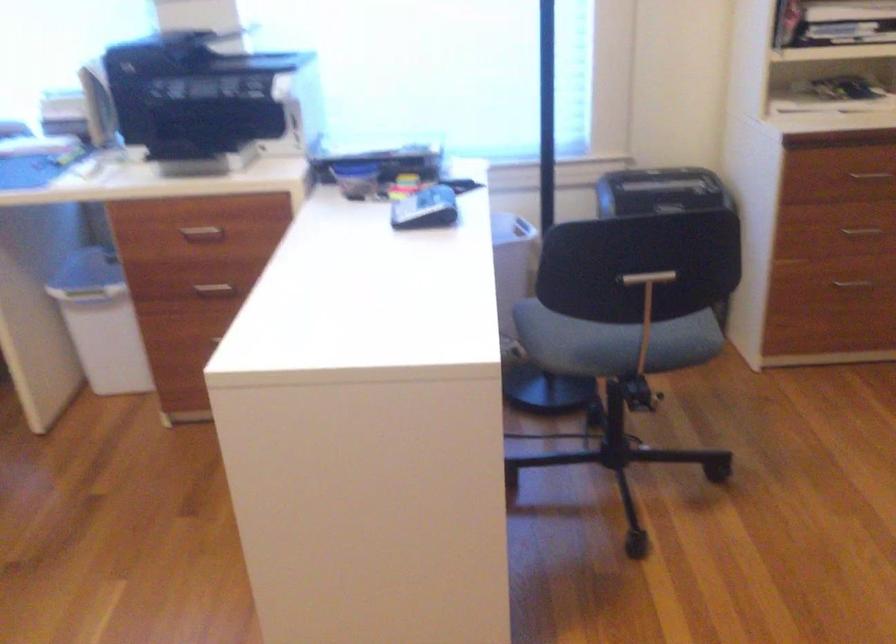
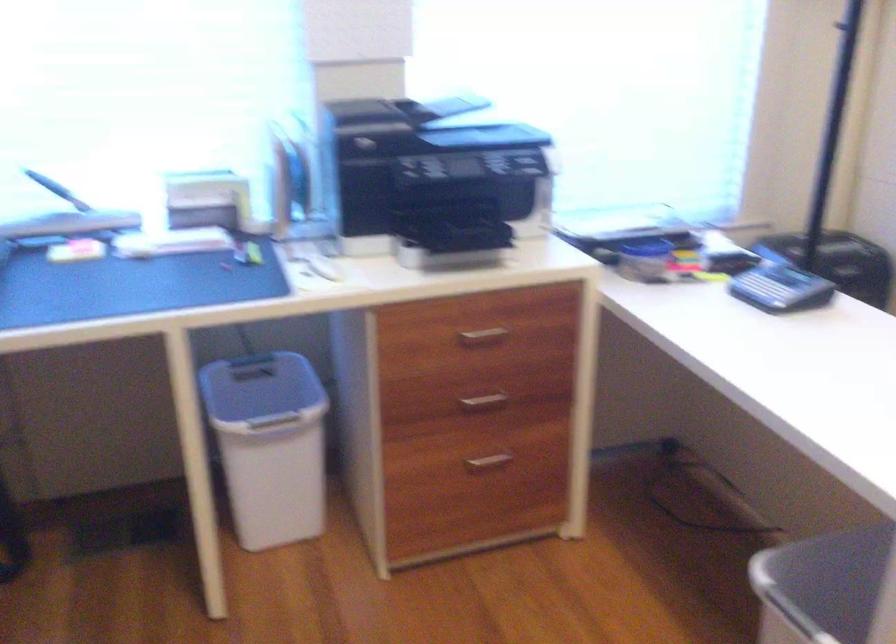
Locate, in the second image, the point that corresponds to (x=416, y=203) in the first image.

(763, 289)